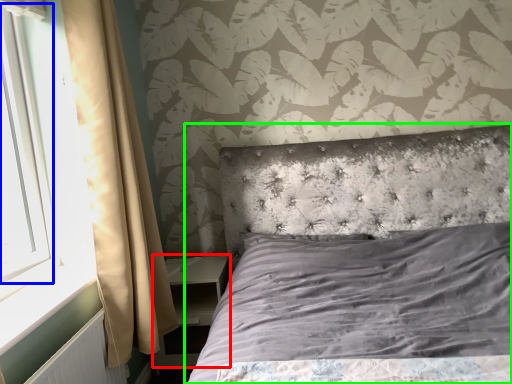
Question: Considering the real-world distances, which object is closest to nightstand (highlighted by a red box)? window screen (highlighted by a blue box) or bed (highlighted by a green box).

Choices:
 (A) window screen
 (B) bed

Answer: (B)